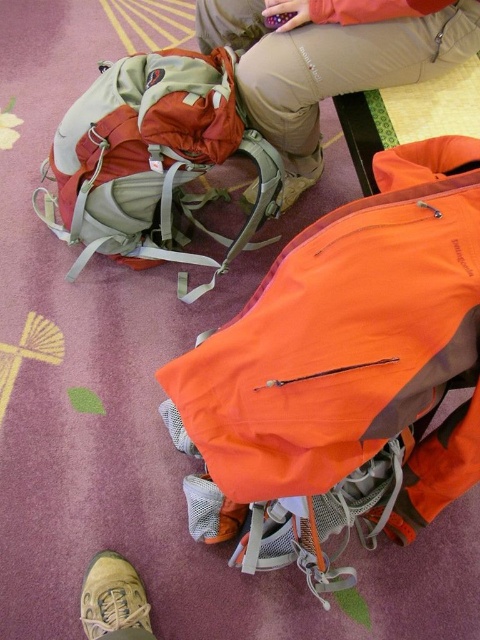
Question: Which object is the farthest from the orange fabric backpack at center?

Choices:
 (A) tan suede shoe at lower left
 (B) matte green backpack at center

Answer: (B)

Question: Does orange fabric backpack at center appear on the right side of tan suede shoe at lower left?

Choices:
 (A) no
 (B) yes

Answer: (B)

Question: Which of the following is the farthest from the observer?

Choices:
 (A) (201, 337)
 (B) (86, 593)
 (C) (226, 13)
 (D) (159, 205)

Answer: (D)

Question: Is orange fabric backpack at center above orange fabric pants at center?

Choices:
 (A) yes
 (B) no

Answer: (B)

Question: Which point is farther to the camera?

Choices:
 (A) orange fabric backpack at center
 (B) orange fabric pants at center

Answer: (B)

Question: Is matte green backpack at center above tan suede shoe at lower left?

Choices:
 (A) yes
 (B) no

Answer: (A)